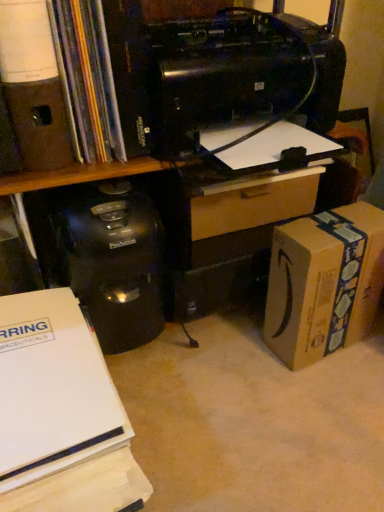
Question: From a real-world perspective, relative to black plastic printer at upper center, is matte brown speaker at upper left, which is the 1th office supplies from top to bottom, vertically above or below?

Choices:
 (A) above
 (B) below

Answer: (A)

Question: In the image, is matte brown speaker at upper left, which is the 1th office supplies from top to bottom, positioned in front of or behind black plastic printer at upper center?

Choices:
 (A) behind
 (B) front

Answer: (A)

Question: Which of these objects is positioned farthest from the white paper at lower left, placed as the 2th office supplies when sorted from top to bottom?

Choices:
 (A) brown cardboard box at lower right
 (B) matte black book at upper left
 (C) wooden drawer at center
 (D) black plastic printer at upper center
 (E) matte brown speaker at upper left, placed as the second office supplies when sorted from bottom to top

Answer: (A)

Question: Which of these objects is positioned closest to the brown cardboard box at lower right?

Choices:
 (A) black plastic printer at upper center
 (B) matte black book at upper left
 (C) matte brown speaker at upper left, placed as the second office supplies when sorted from bottom to top
 (D) wooden drawer at center
 (E) white paper at lower left, placed as the 2th office supplies when sorted from top to bottom

Answer: (D)